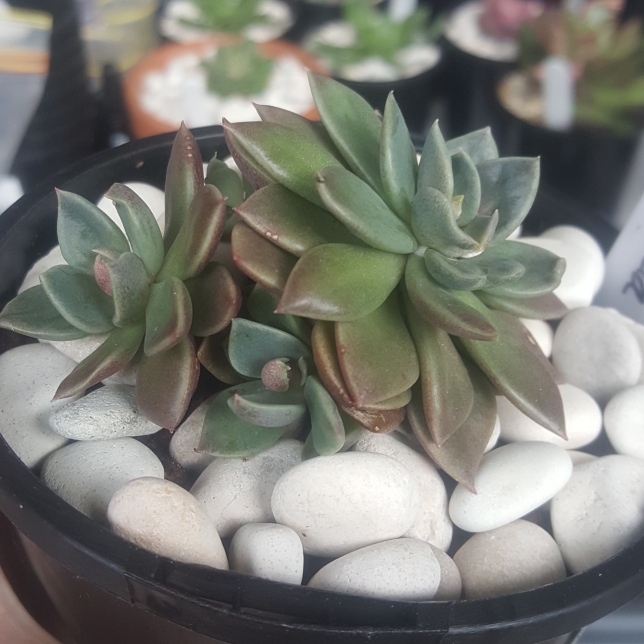
Locate an element on the screen. The width and height of the screenshot is (644, 644). succulent is located at coordinates (384, 247), (153, 276), (243, 406).